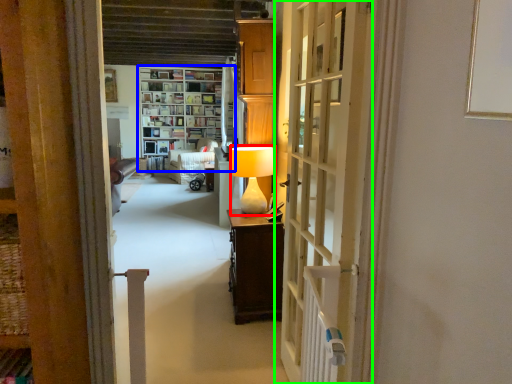
Question: Based on their relative distances, which object is nearer to table lamp (highlighted by a red box)? Choose from shelf (highlighted by a blue box) and door (highlighted by a green box).

Choices:
 (A) shelf
 (B) door

Answer: (B)